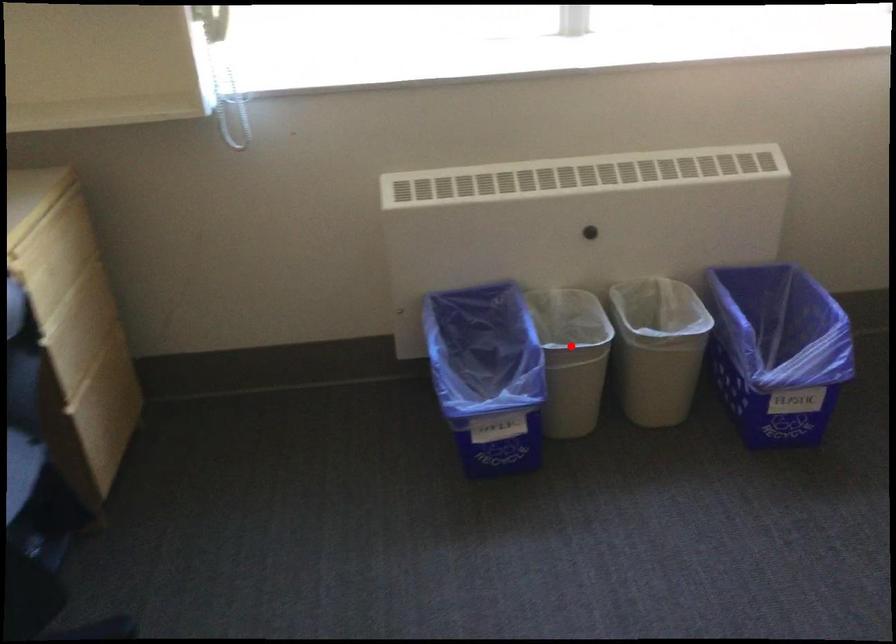
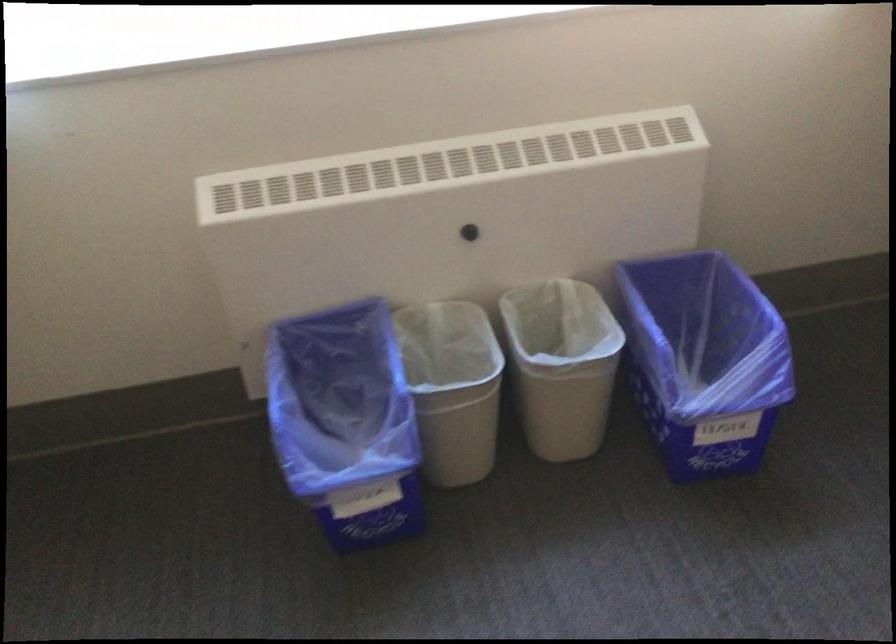
Question: I am providing you with two images of the same scene from different viewpoints. A red point is marked on the first image. Is the red point's position out of view in image 2?

Choices:
 (A) Yes
 (B) No

Answer: (B)